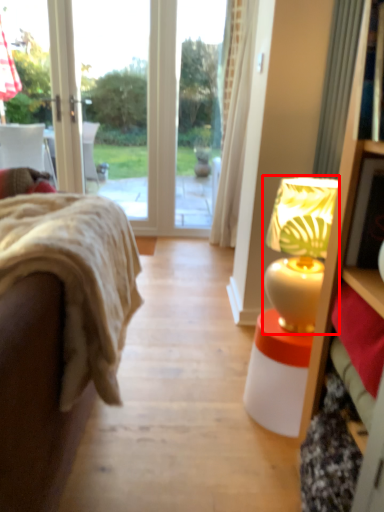
Question: From the image's perspective, considering the relative positions of table lamp (annotated by the red box) and studio couch in the image provided, where is table lamp (annotated by the red box) located with respect to the staircase?

Choices:
 (A) above
 (B) below

Answer: (A)